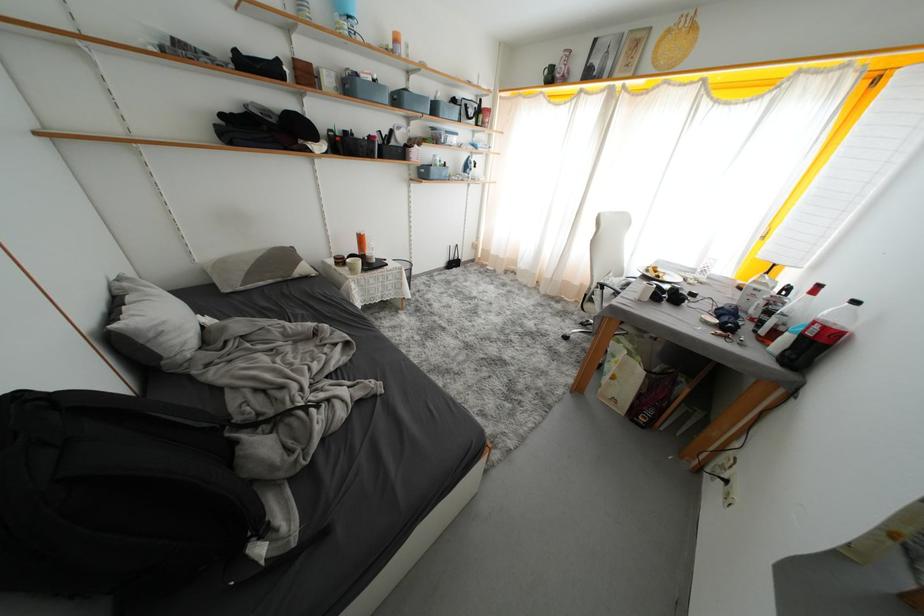
This screenshot has width=924, height=616. Describe the element at coordinates (727, 318) in the screenshot. I see `the black camera` at that location.